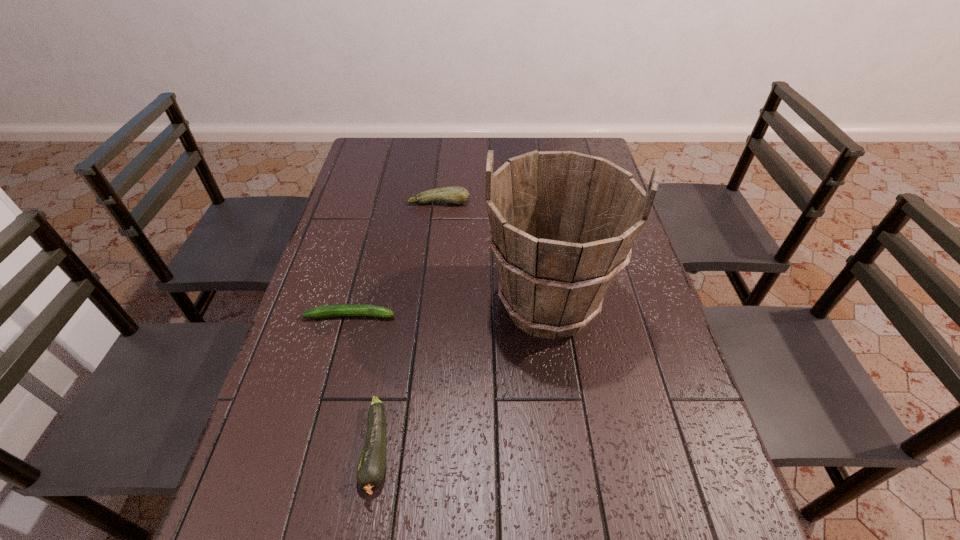
The width and height of the screenshot is (960, 540). What are the coordinates of `bucket` in the screenshot? It's located at (562, 224).

Locate an element on the screen. the tallest object is located at coordinates (562, 224).

At what (x,y) coordinates should I click in order to perform the action: click on the farthest zucchini. Please return your answer as a coordinate pair (x, y). Looking at the image, I should click on (454, 194).

Where is `the nearest zucchini`? Image resolution: width=960 pixels, height=540 pixels. the nearest zucchini is located at coordinates (371, 468).

The height and width of the screenshot is (540, 960). In order to click on the shortest zucchini in this screenshot , I will do `click(345, 309)`.

Locate an element on the screen. This screenshot has height=540, width=960. the shortest object is located at coordinates (345, 309).

Locate an element on the screen. The height and width of the screenshot is (540, 960). vacant space positioned 0.340m on the left of the tallest object is located at coordinates (351, 305).

This screenshot has height=540, width=960. I want to click on free space located at the stem end of the farthest object, so 436,232.

Find the location of a particular element. This screenshot has width=960, height=540. free space located on the front-facing side of the second nearest zucchini is located at coordinates point(447,315).

Find the location of a particular element. The width and height of the screenshot is (960, 540). object at the left edge is located at coordinates (345, 309).